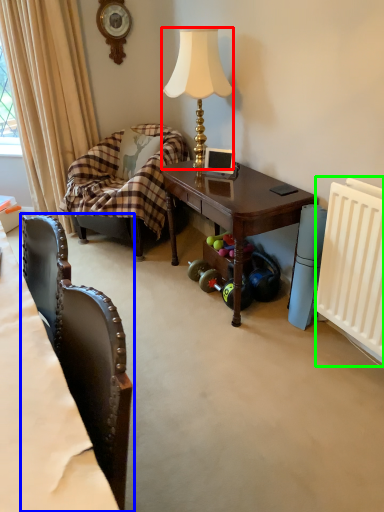
Question: Based on their relative distances, which object is farther from lamp (highlighted by a red box)? Choose from chair (highlighted by a blue box) and radiator (highlighted by a green box).

Choices:
 (A) chair
 (B) radiator

Answer: (A)